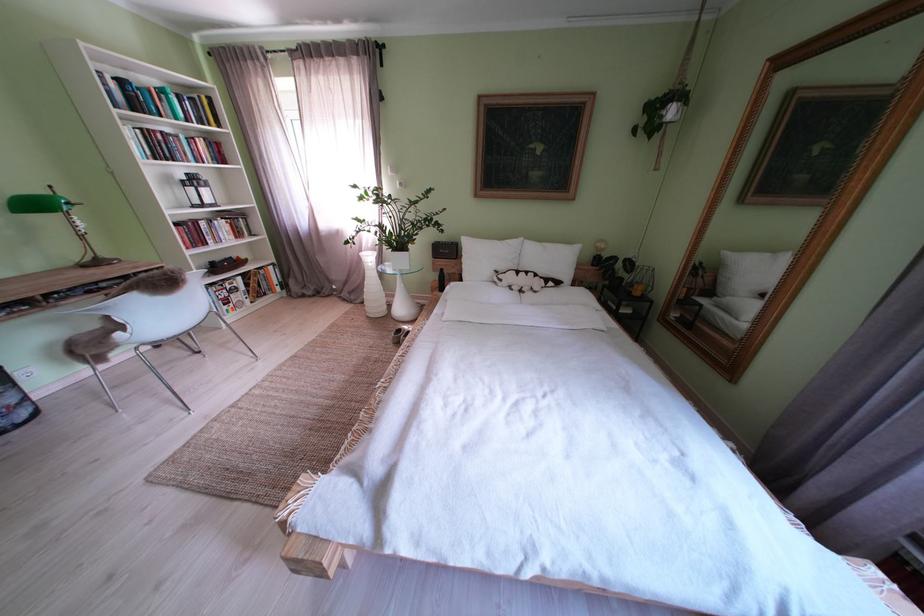
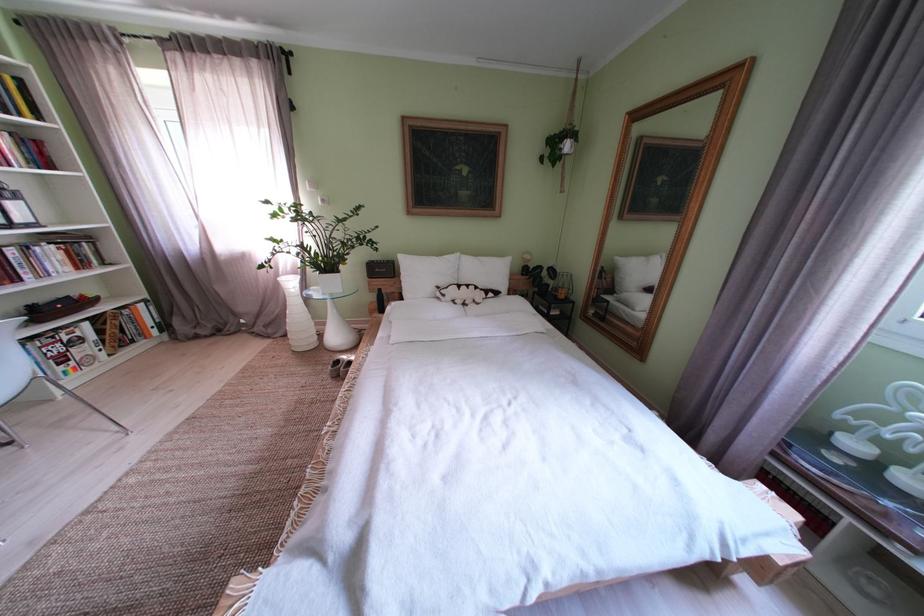
Where in the second image is the point corresponding to pixel 213 148 from the first image?

(16, 145)